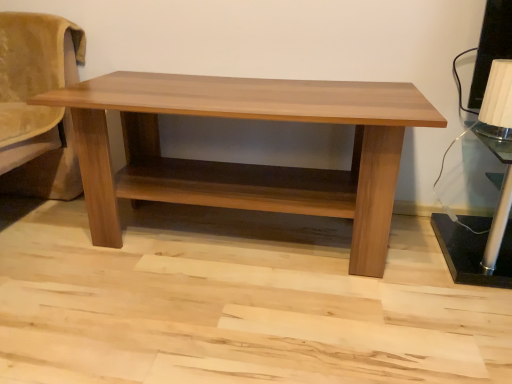
Question: Are white textured lampshade at upper right, the 1th table lamp positioned from the top, and light brown wood table at center beside each other?

Choices:
 (A) yes
 (B) no

Answer: (B)

Question: Is white textured lampshade at upper right, the 1th table lamp positioned from the top, positioned with its back to light brown wood table at center?

Choices:
 (A) no
 (B) yes

Answer: (A)

Question: Considering the relative sizes of white textured lampshade at upper right, which ranks as the 2th table lamp in bottom-to-top order, and light brown wood table at center in the image provided, is white textured lampshade at upper right, which ranks as the 2th table lamp in bottom-to-top order, bigger than light brown wood table at center?

Choices:
 (A) yes
 (B) no

Answer: (B)

Question: Is white textured lampshade at upper right, the 1th table lamp positioned from the top, oriented towards light brown wood table at center?

Choices:
 (A) no
 (B) yes

Answer: (A)

Question: Is white textured lampshade at upper right, which ranks as the 2th table lamp in bottom-to-top order, further to the viewer compared to light brown wood table at center?

Choices:
 (A) no
 (B) yes

Answer: (B)

Question: Looking at their shapes, would you say light brown wood table at center is wider or thinner than black metallic table lamp at right, which appears as the 2th table lamp when viewed from the top?

Choices:
 (A) thin
 (B) wide

Answer: (B)

Question: Choose the correct answer: Is light brown wood table at center inside black metallic table lamp at right, which appears as the 2th table lamp when viewed from the top, or outside it?

Choices:
 (A) inside
 (B) outside

Answer: (B)

Question: Would you say light brown wood table at center is to the left or to the right of black metallic table lamp at right, which appears as the 2th table lamp when viewed from the top, in the picture?

Choices:
 (A) right
 (B) left

Answer: (B)

Question: Considering the positions of light brown wood table at center and black metallic table lamp at right, which appears as the 2th table lamp when viewed from the top, in the image, is light brown wood table at center taller or shorter than black metallic table lamp at right, which appears as the 2th table lamp when viewed from the top,?

Choices:
 (A) tall
 (B) short

Answer: (A)

Question: In terms of width, does white textured lampshade at upper right, the 1th table lamp positioned from the top, look wider or thinner when compared to light brown wood table at center?

Choices:
 (A) thin
 (B) wide

Answer: (A)

Question: Is point [501, 71] positioned closer to the camera than point [243, 193]?

Choices:
 (A) farther
 (B) closer

Answer: (B)

Question: From a real-world perspective, is white textured lampshade at upper right, the 1th table lamp positioned from the top, positioned above or below light brown wood table at center?

Choices:
 (A) below
 (B) above

Answer: (B)

Question: Is white textured lampshade at upper right, which ranks as the 2th table lamp in bottom-to-top order, inside or outside of light brown wood table at center?

Choices:
 (A) outside
 (B) inside

Answer: (A)

Question: Considering the positions of black metallic table lamp at right, the 1th table lamp in the bottom-to-top sequence, and light brown wood table at center in the image, is black metallic table lamp at right, the 1th table lamp in the bottom-to-top sequence, wider or thinner than light brown wood table at center?

Choices:
 (A) thin
 (B) wide

Answer: (A)

Question: From a real-world perspective, is black metallic table lamp at right, the 1th table lamp in the bottom-to-top sequence, positioned above or below light brown wood table at center?

Choices:
 (A) above
 (B) below

Answer: (B)